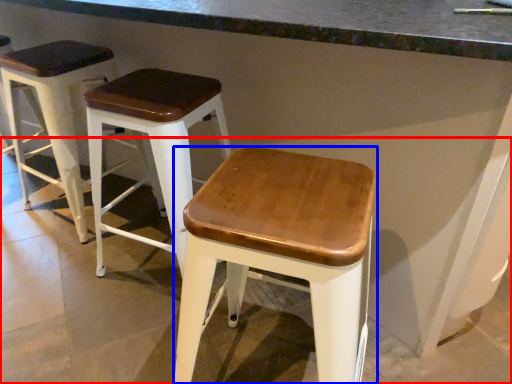
Question: Which object appears farthest to the camera in this image, concrete (highlighted by a red box) or stool (highlighted by a blue box)?

Choices:
 (A) concrete
 (B) stool

Answer: (B)